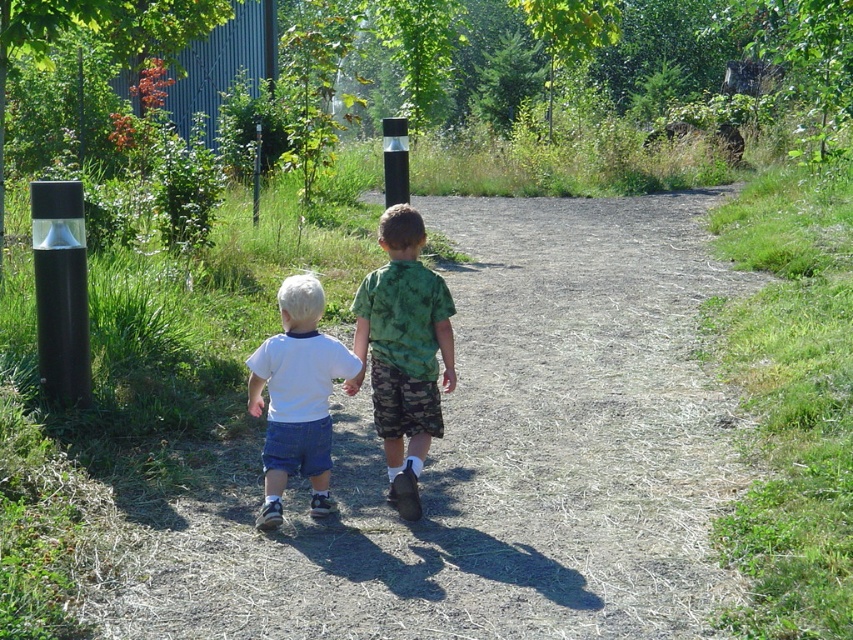
Does green camouflage shirt at center appear under white cotton shirt at center?

No.

Does green camouflage shirt at center lie in front of white cotton shirt at center?

No, it is not.

Between point (418, 397) and point (316, 396), which one is positioned behind?

Point (418, 397)

Locate an element on the screen. This screenshot has height=640, width=853. green camouflage shirt at center is located at coordinates (404, 352).

Looking at this image, how distant is brown dirt path at center from white cotton shirt at center?

brown dirt path at center and white cotton shirt at center are 1.68 meters apart.

Can you confirm if brown dirt path at center is thinner than white cotton shirt at center?

No, brown dirt path at center is not thinner than white cotton shirt at center.

Locate an element on the screen. brown dirt path at center is located at coordinates (495, 458).

Does brown dirt path at center appear under green camouflage shirt at center?

No, brown dirt path at center is not below green camouflage shirt at center.

Does brown dirt path at center appear on the right side of green camouflage shirt at center?

Yes, brown dirt path at center is to the right of green camouflage shirt at center.

The image size is (853, 640). In order to click on brown dirt path at center in this screenshot , I will do `click(495, 458)`.

In order to click on brown dirt path at center in this screenshot , I will do coord(495,458).